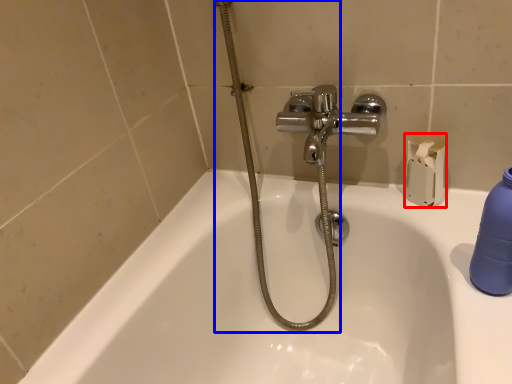
Question: Which point is further to the camera, toilet paper (highlighted by a red box) or shower (highlighted by a blue box)?

Choices:
 (A) toilet paper
 (B) shower

Answer: (A)